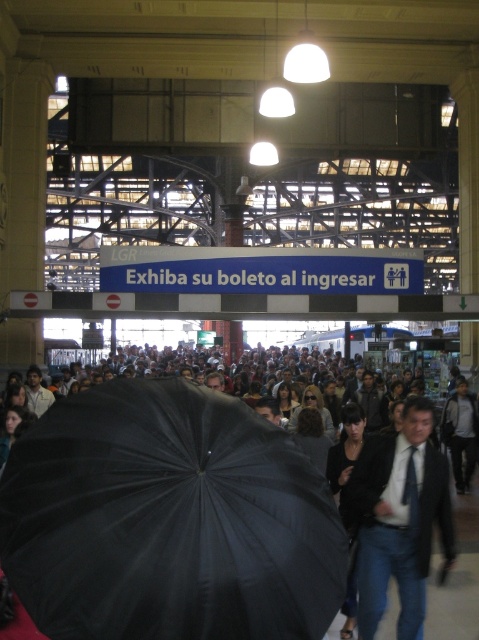
Question: Which point is farther to the camera?

Choices:
 (A) dark blue suit at center
 (B) black matte umbrella at center

Answer: (A)

Question: Is black matte umbrella at center further to camera compared to dark blue suit at center?

Choices:
 (A) no
 (B) yes

Answer: (A)

Question: Which point appears closest to the camera in this image?

Choices:
 (A) (405, 598)
 (B) (19, 516)

Answer: (B)

Question: Can you confirm if black matte umbrella at center is positioned below dark blue suit at center?

Choices:
 (A) no
 (B) yes

Answer: (A)

Question: Is black matte umbrella at center to the right of dark blue suit at center from the viewer's perspective?

Choices:
 (A) yes
 (B) no

Answer: (B)